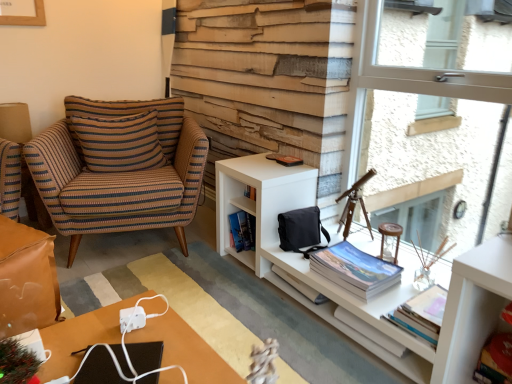
Image resolution: width=512 pixels, height=384 pixels. What are the coordinates of `free space between brown striped fabric armchair at left and white matte cabinet at right` in the screenshot? It's located at (x=209, y=300).